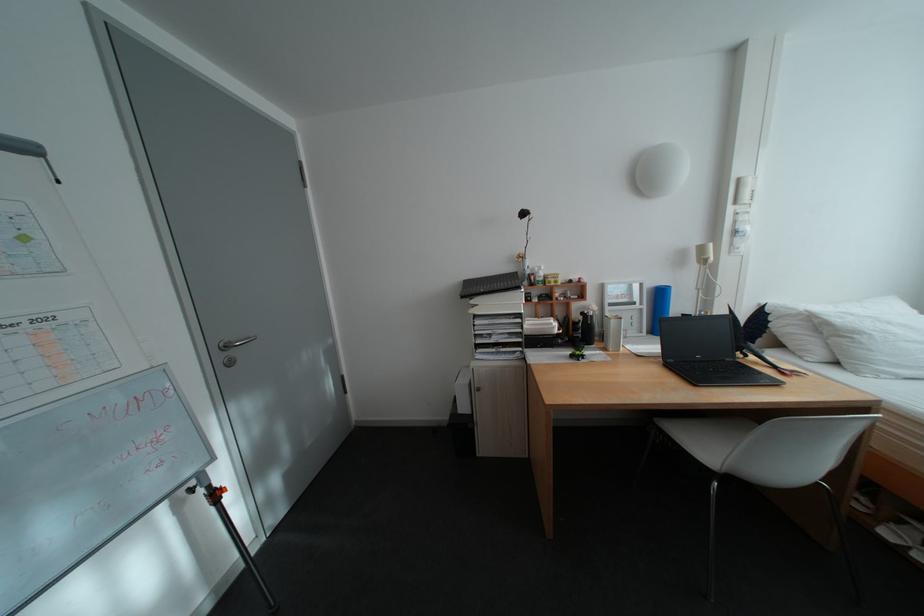
Describe the element at coordinates (213, 493) in the screenshot. The width and height of the screenshot is (924, 616). I see `the orange adjustment knob` at that location.